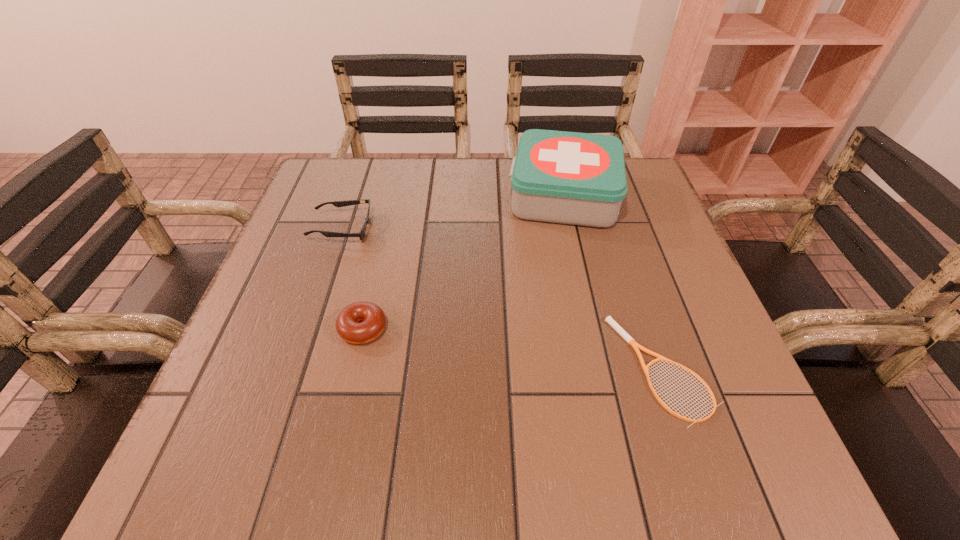
Where is `vacant space that satisfies the following two spatial constraints: 1. on the back side of the doughnut; 2. on the right side of the first-aid kit`? vacant space that satisfies the following two spatial constraints: 1. on the back side of the doughnut; 2. on the right side of the first-aid kit is located at coordinates (394, 195).

You are a GUI agent. You are given a task and a screenshot of the screen. Output one action in this format:
    pyautogui.click(x=<x>, y=<y>)
    Task: Click on the free space in the image that satisfies the following two spatial constraints: 1. on the front-facing side of the doughnut; 2. on the right side of the sunglasses
    The width and height of the screenshot is (960, 540).
    Given the screenshot: What is the action you would take?
    pyautogui.click(x=307, y=328)